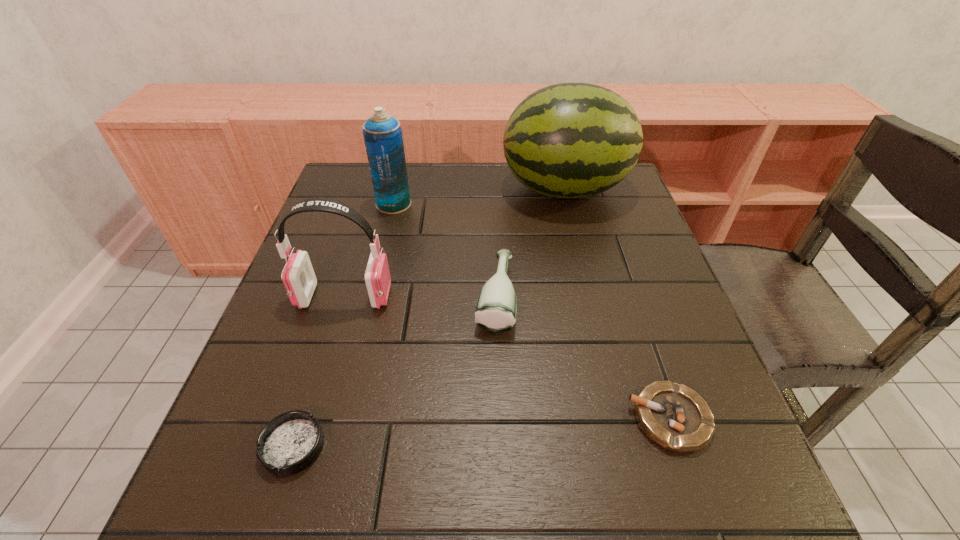
At what (x,y) coordinates should I click in order to perform the action: click on vacant area at the right edge of the desktop. Please return your answer as a coordinate pair (x, y). Looking at the image, I should click on (592, 258).

The width and height of the screenshot is (960, 540). I want to click on vacant region between the earphone and the watermelon, so click(x=454, y=243).

At what (x,y) coordinates should I click in order to perform the action: click on free spot between the watermelon and the shortest object. Please return your answer as a coordinate pair (x, y). Image resolution: width=960 pixels, height=540 pixels. Looking at the image, I should click on (429, 318).

I want to click on free spot between the earphone and the left ashtray, so click(x=319, y=372).

Identify the location of empty space between the shortest object and the earphone. The height and width of the screenshot is (540, 960). (319, 372).

Where is `free space between the aerosol can and the shorter ashtray`? free space between the aerosol can and the shorter ashtray is located at coordinates (344, 325).

You are a GUI agent. You are given a task and a screenshot of the screen. Output one action in this format:
    pyautogui.click(x=<x>, y=<y>)
    Task: Click on the free spot between the earphone and the taller ashtray
    
    Given the screenshot: What is the action you would take?
    pyautogui.click(x=507, y=357)

I want to click on empty location between the aerosol can and the third shortest object, so click(444, 251).

This screenshot has width=960, height=540. I want to click on free area in between the fourth tallest object and the left ashtray, so click(395, 372).

The image size is (960, 540). I want to click on vacant space in between the earphone and the right ashtray, so click(507, 357).